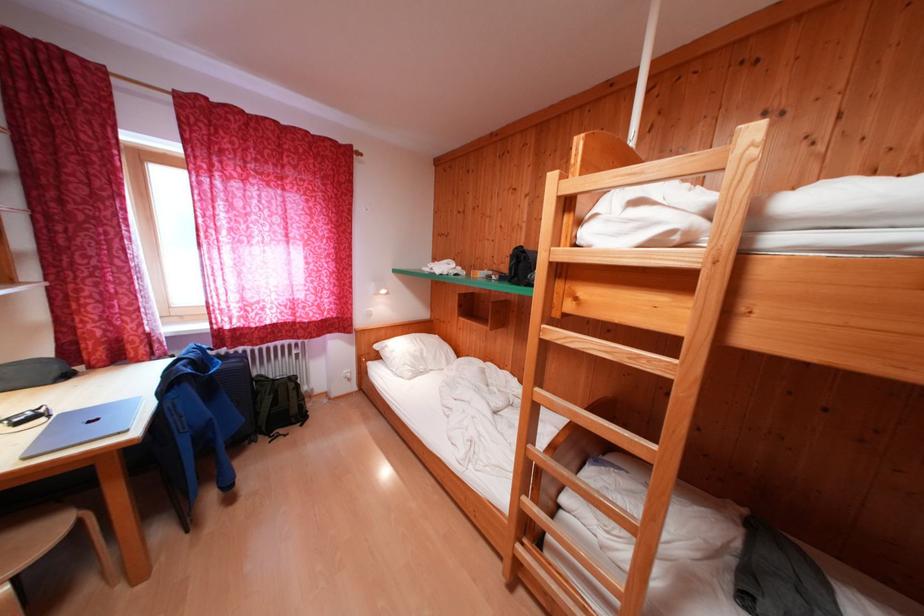
Find where to lift the white pillow. Please return your answer as a coordinate pair (x, y).

(415, 354)